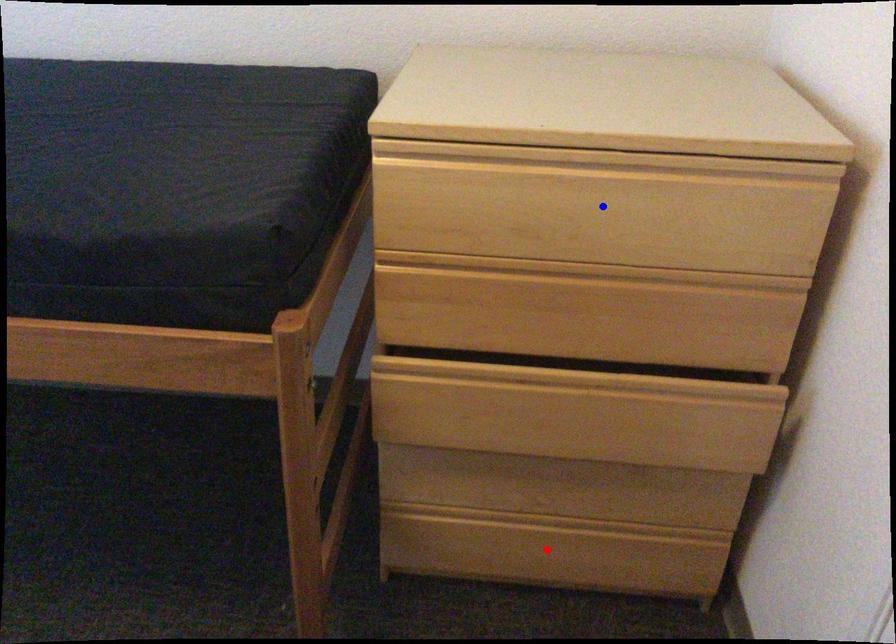
Question: Two points are marked on the image. Which point is closer to the camera?

Choices:
 (A) Blue point is closer.
 (B) Red point is closer.

Answer: (A)